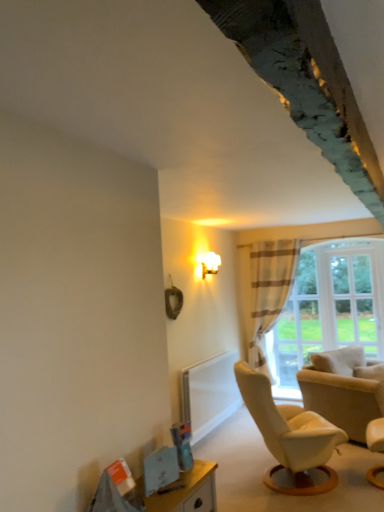
This screenshot has height=512, width=384. Describe the element at coordinates (342, 390) in the screenshot. I see `beige fabric chair at lower right, which is counted as the second chair, starting from the front` at that location.

The width and height of the screenshot is (384, 512). Describe the element at coordinates (375, 435) in the screenshot. I see `white leather chair at lower right, marked as the first chair in a front-to-back arrangement` at that location.

Find the location of `matte white sconce at upper right`. matte white sconce at upper right is located at coordinates (209, 263).

Describe the element at coordinates (188, 490) in the screenshot. I see `wooden table at lower left` at that location.

Find the location of a particular element. clear glass window at right is located at coordinates (357, 300).

This screenshot has height=512, width=384. In order to click on beige fabric chair at lower right, which is counted as the second chair, starting from the front in this screenshot , I will do `click(342, 390)`.

Do you think white sheer curtain at center is within matte white sconce at upper right, or outside of it?

white sheer curtain at center is spatially situated outside matte white sconce at upper right.

Are white sheer curtain at center and matte white sconce at upper right located far from each other?

No, white sheer curtain at center is not far away from matte white sconce at upper right.

From a real-world perspective, who is located higher, white sheer curtain at center or matte white sconce at upper right?

matte white sconce at upper right, from a real-world perspective.

Considering the positions of points (266, 277) and (216, 258), is point (266, 277) farther from camera compared to point (216, 258)?

Yes, it is behind point (216, 258).

From the image's perspective, is white leather chair at lower right, acting as the second chair starting from the back, positioned above or below matte white sconce at upper right?

white leather chair at lower right, acting as the second chair starting from the back, is situated lower than matte white sconce at upper right in the image.

Between white leather chair at lower right, marked as the first chair in a front-to-back arrangement, and matte white sconce at upper right, which one appears on the left side from the viewer's perspective?

matte white sconce at upper right.

In terms of width, does white leather chair at lower right, acting as the second chair starting from the back, look wider or thinner when compared to matte white sconce at upper right?

Considering their sizes, white leather chair at lower right, acting as the second chair starting from the back, looks slimmer than matte white sconce at upper right.

Looking at this image, what's the angular difference between white leather chair at lower right, acting as the second chair starting from the back, and matte white sconce at upper right's facing directions?

9.55 degrees.

Does clear glass window at right lie in front of beige fabric chair at lower right, which is counted as the second chair, starting from the front?

That is False.

Is beige fabric chair at lower right, which is counted as the second chair, starting from the front, inside clear glass window at right?

Actually, beige fabric chair at lower right, which is counted as the second chair, starting from the front, is outside clear glass window at right.

Is clear glass window at right next to beige fabric chair at lower right, which is counted as the second chair, starting from the front?

No, clear glass window at right is not in contact with beige fabric chair at lower right, which is counted as the second chair, starting from the front.

Is clear glass window at right oriented away from beige fabric chair at lower right, the 1th chair positioned from the back?

No, clear glass window at right's orientation is not away from beige fabric chair at lower right, the 1th chair positioned from the back.

Between wooden table at lower left and white sheer curtain at center, which one has less height?

wooden table at lower left.

Is wooden table at lower left far from white sheer curtain at center?

Yes, wooden table at lower left and white sheer curtain at center are quite far apart.

Could you tell me if wooden table at lower left is facing white sheer curtain at center?

No, wooden table at lower left is not turned towards white sheer curtain at center.

Is white sheer curtain at center a part of wooden table at lower left?

No, white sheer curtain at center is not surrounded by wooden table at lower left.

Is wooden table at lower left outside of beige fabric chair at lower right, the 1th chair positioned from the back?

Indeed, wooden table at lower left is completely outside beige fabric chair at lower right, the 1th chair positioned from the back.

Is wooden table at lower left at the right side of beige fabric chair at lower right, which is counted as the second chair, starting from the front?

No, wooden table at lower left is not to the right of beige fabric chair at lower right, which is counted as the second chair, starting from the front.

From a real-world perspective, who is located higher, wooden table at lower left or beige fabric chair at lower right, which is counted as the second chair, starting from the front?

From a 3D spatial view, wooden table at lower left is above.

In terms of height, does wooden table at lower left look taller or shorter compared to beige fabric chair at lower right, the 1th chair positioned from the back?

wooden table at lower left is shorter than beige fabric chair at lower right, the 1th chair positioned from the back.

Does white sheer curtain at center have a lesser width compared to wooden table at lower left?

No, white sheer curtain at center is not thinner than wooden table at lower left.

From the image's perspective, would you say white sheer curtain at center is shown under wooden table at lower left?

Actually, white sheer curtain at center appears above wooden table at lower left in the image.

Between white sheer curtain at center and wooden table at lower left, which one appears on the left side from the viewer's perspective?

wooden table at lower left is more to the left.

At what (x,y) coordinates should I click in order to perform the action: click on curtain located underneath the matte white sconce at upper right (from a real-world perspective). Please return your answer as a coordinate pair (x, y). Image resolution: width=384 pixels, height=512 pixels. Looking at the image, I should click on (269, 291).

Does matte white sconce at upper right have a smaller size compared to white sheer curtain at center?

Yes, matte white sconce at upper right is smaller than white sheer curtain at center.

Based on the photo, from the image's perspective, relative to white sheer curtain at center, is matte white sconce at upper right above or below?

Clearly, from the image's perspective, matte white sconce at upper right is above white sheer curtain at center.

The image size is (384, 512). I want to click on light fixture above the white sheer curtain at center (from a real-world perspective), so click(x=209, y=263).

From the image's perspective, count 2nd chairs downward from the matte white sconce at upper right and point to it. Please provide its 2D coordinates.

[(375, 435)]

Considering their positions, is white sheer curtain at center positioned closer to clear glass window at right than matte white sconce at upper right?

Based on the image, white sheer curtain at center appears to be nearer to clear glass window at right.

Which object lies nearer to the anchor point white leather chair at lower right, marked as the first chair in a front-to-back arrangement, wooden table at lower left or white sheer curtain at center?

Based on the image, wooden table at lower left appears to be nearer to white leather chair at lower right, marked as the first chair in a front-to-back arrangement.

Based on their spatial positions, is white sheer curtain at center or matte white sconce at upper right further from wooden table at lower left?

Among the two, white sheer curtain at center is located further to wooden table at lower left.

Considering their positions, is beige fabric chair at lower right, the 1th chair positioned from the back, positioned further to white leather chair at lower right, marked as the first chair in a front-to-back arrangement, than white sheer curtain at center?

white sheer curtain at center is further to white leather chair at lower right, marked as the first chair in a front-to-back arrangement.

From the image, which object appears to be farther from matte white sconce at upper right, white leather chair at lower right, marked as the first chair in a front-to-back arrangement, or white sheer curtain at center?

The object further to matte white sconce at upper right is white leather chair at lower right, marked as the first chair in a front-to-back arrangement.

Considering their positions, is clear glass window at right positioned closer to white leather chair at lower right, acting as the second chair starting from the back, than wooden table at lower left?

Based on the image, clear glass window at right appears to be nearer to white leather chair at lower right, acting as the second chair starting from the back.

From the image, which object appears to be farther from wooden table at lower left, matte white sconce at upper right or clear glass window at right?

clear glass window at right lies further to wooden table at lower left than the other object.

Estimate the real-world distances between objects in this image. Which object is closer to white sheer curtain at center, beige fabric chair at lower right, which is counted as the second chair, starting from the front, or white leather chair at lower right, acting as the second chair starting from the back?

Based on the image, beige fabric chair at lower right, which is counted as the second chair, starting from the front, appears to be nearer to white sheer curtain at center.

This screenshot has height=512, width=384. What are the coordinates of `curtain between beige fabric chair at lower right, the 1th chair positioned from the back, and clear glass window at right from front to back` in the screenshot? It's located at (269, 291).

Where is `curtain between white leather chair at lower right, acting as the second chair starting from the back, and clear glass window at right in the front-back direction`? This screenshot has width=384, height=512. curtain between white leather chair at lower right, acting as the second chair starting from the back, and clear glass window at right in the front-back direction is located at coordinates (269, 291).

You are a GUI agent. You are given a task and a screenshot of the screen. Output one action in this format:
    pyautogui.click(x=<x>, y=<y>)
    Task: Click on the light fixture between beige fabric chair at lower right, which is counted as the second chair, starting from the front, and white sheer curtain at center in the front-back direction
    
    Given the screenshot: What is the action you would take?
    pyautogui.click(x=209, y=263)

In order to click on chair between matte white sconce at upper right and beige fabric chair at lower right, which is counted as the second chair, starting from the front, in the horizontal direction in this screenshot , I will do `click(375, 435)`.